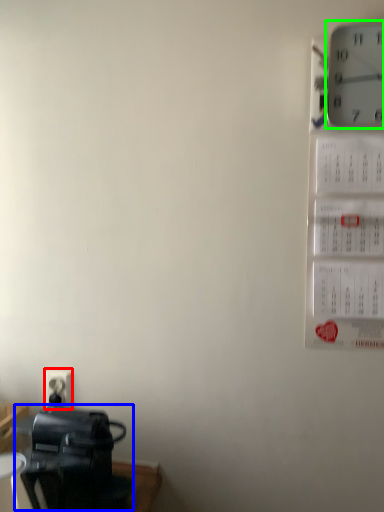
Question: Based on their relative distances, which object is farther from electric outlet (highlighted by a red box)? Choose from appliance (highlighted by a blue box) and wall clock (highlighted by a green box).

Choices:
 (A) appliance
 (B) wall clock

Answer: (B)